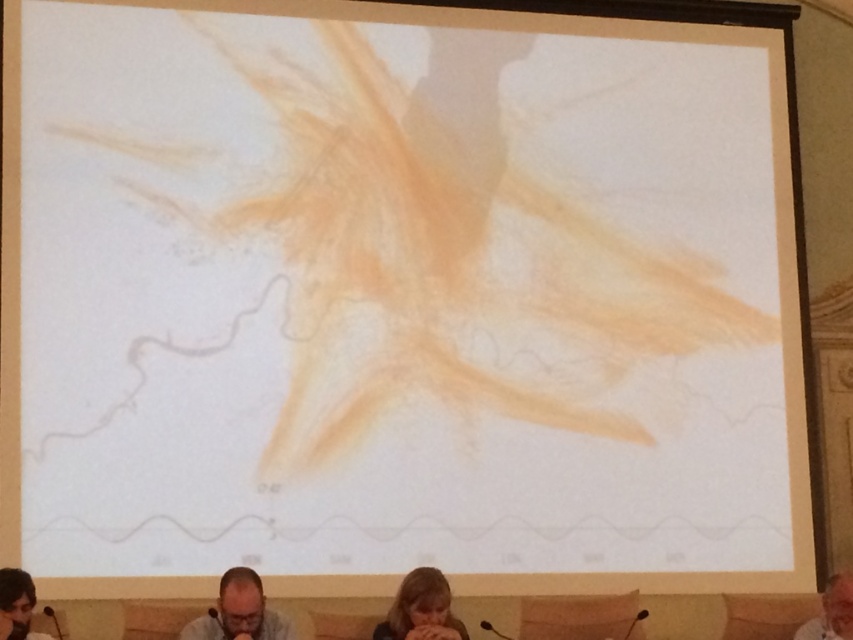
Does gray matte shirt at lower center have a greater width compared to gray hair at lower right?

Indeed, gray matte shirt at lower center has a greater width compared to gray hair at lower right.

How distant is gray matte shirt at lower center from gray hair at lower right?

gray matte shirt at lower center and gray hair at lower right are 2.80 meters apart.

Which is in front, point (199, 634) or point (839, 627)?

Point (199, 634) is in front.

Find the location of a particular element. The width and height of the screenshot is (853, 640). gray matte shirt at lower center is located at coordinates (239, 612).

Is matte black microphone at lower left shorter than gray hair at lower right?

Correct, matte black microphone at lower left is not as tall as gray hair at lower right.

Does matte black microphone at lower left have a smaller size compared to gray hair at lower right?

Correct, matte black microphone at lower left occupies less space than gray hair at lower right.

This screenshot has height=640, width=853. I want to click on matte black microphone at lower left, so pos(16,605).

Is gray matte shirt at lower center bigger than blonde hair at lower center?

Indeed, gray matte shirt at lower center has a larger size compared to blonde hair at lower center.

Looking at this image, can you confirm if gray matte shirt at lower center is smaller than blonde hair at lower center?

No.

Where is `gray matte shirt at lower center`? gray matte shirt at lower center is located at coordinates pos(239,612).

Image resolution: width=853 pixels, height=640 pixels. I want to click on gray matte shirt at lower center, so click(x=239, y=612).